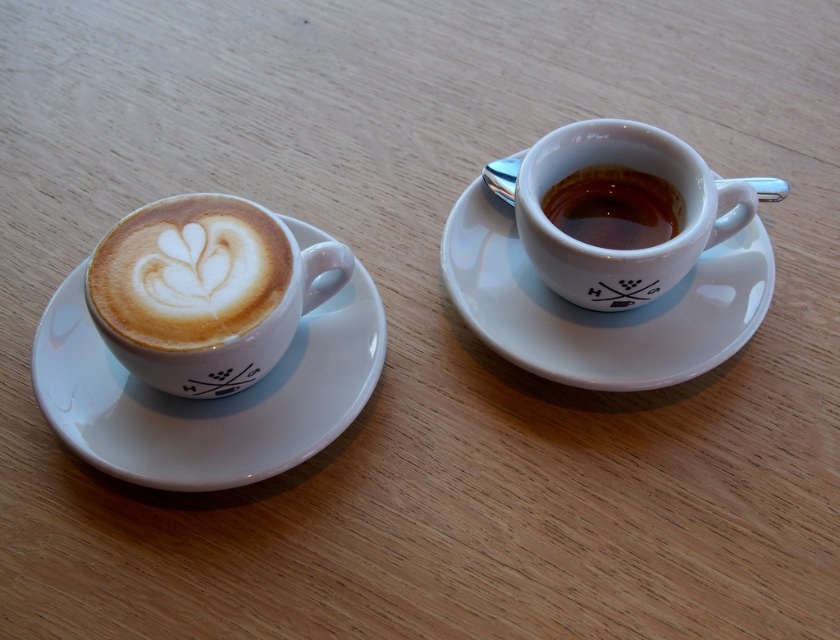
You are at a coffee shop and want to choose between the matte ceramic espresso cup at right and the shiny ceramic espresso cup at right. Which one has a larger capacity?

The matte ceramic espresso cup at right has a larger capacity since it is bigger than the shiny ceramic espresso cup at right.

You are at a coffee shop and want to place your phone on the table. The phone is 10 cm long. There is a point at coordinates [599,310] on the table. Can you place your phone horizontally on the table without overlapping any objects?

The point at coordinates [599,310] corresponds to the white glossy saucer at right, so placing the phone horizontally there would overlap the saucer. Choose another spot on the table that is free of objects.

You have two saucers on a table. The white ceramic saucer at left and the white glossy saucer at right. If you want to place a cookie that requires 10 cm of space, which saucer can accommodate it?

The white glossy saucer at right has a larger width than the white ceramic saucer at left, so it can accommodate the cookie that requires 10 cm of space.